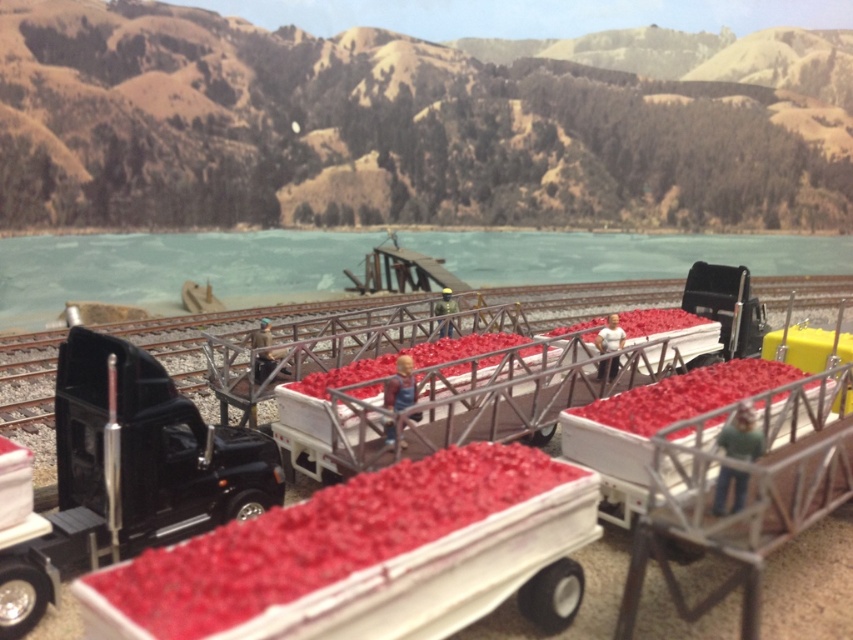
Does point (312, 232) come farther from viewer compared to point (325, 384)?

Yes, it is behind point (325, 384).

Between clear blue water at upper center and rubberized plastic produce at center, which one has more height?

clear blue water at upper center is taller.

Is point (160, 266) positioned after point (317, 384)?

Yes, point (160, 266) is behind point (317, 384).

This screenshot has width=853, height=640. Find the location of `clear blue water at upper center`. clear blue water at upper center is located at coordinates (172, 269).

Between smooth red plastic produce at center and smooth plastic crate of red berries at center, which one is positioned higher?

smooth plastic crate of red berries at center is above.

Can you confirm if smooth red plastic produce at center is positioned to the right of smooth plastic crate of red berries at center?

No, smooth red plastic produce at center is not to the right of smooth plastic crate of red berries at center.

Does point (281, 538) lie in front of point (767, 378)?

Yes, it is.

This screenshot has height=640, width=853. I want to click on smooth red plastic produce at center, so click(x=357, y=552).

Between smooth plastic crate of red berries at center and rubberized plastic produce at center, which one is positioned lower?

Positioned lower is smooth plastic crate of red berries at center.

Is point (593, 401) farther from camera compared to point (505, 339)?

No.

Identify the location of smooth plastic crate of red berries at center. (686, 394).